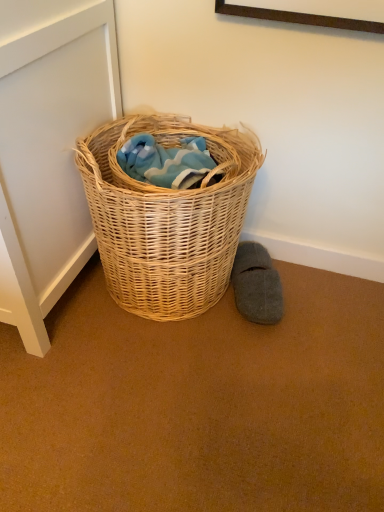
Image resolution: width=384 pixels, height=512 pixels. What do you see at coordinates (167, 218) in the screenshot?
I see `woven natural basket at center` at bounding box center [167, 218].

The height and width of the screenshot is (512, 384). What are the coordinates of `woven natural basket at center` in the screenshot? It's located at tap(167, 218).

Image resolution: width=384 pixels, height=512 pixels. What do you see at coordinates (256, 285) in the screenshot?
I see `gray felt slipper at lower right` at bounding box center [256, 285].

Locate an element on the screen. gray felt slipper at lower right is located at coordinates (256, 285).

Locate an element on the screen. woven natural basket at center is located at coordinates (167, 218).

Can you confirm if gray felt slipper at lower right is positioned to the right of woven natural basket at center?

Yes.

Is gray felt slipper at lower right positioned behind woven natural basket at center?

Yes, it is.

Is point (244, 259) in front of point (137, 286)?

No.

From the image's perspective, between gray felt slipper at lower right and woven natural basket at center, who is located below?

gray felt slipper at lower right is shown below in the image.

From a real-world perspective, which object rests below the other?

gray felt slipper at lower right is physically lower.

Considering the sizes of objects gray felt slipper at lower right and woven natural basket at center in the image provided, who is thinner, gray felt slipper at lower right or woven natural basket at center?

Thinner between the two is gray felt slipper at lower right.

Based on the photo, considering the sizes of objects gray felt slipper at lower right and woven natural basket at center in the image provided, who is taller, gray felt slipper at lower right or woven natural basket at center?

woven natural basket at center is taller.

Does gray felt slipper at lower right have a larger size compared to woven natural basket at center?

No.

Do you think gray felt slipper at lower right is within woven natural basket at center, or outside of it?

gray felt slipper at lower right exists outside the volume of woven natural basket at center.

Is gray felt slipper at lower right not near woven natural basket at center?

Actually, gray felt slipper at lower right and woven natural basket at center are a little close together.

Is gray felt slipper at lower right facing towards woven natural basket at center?

No.

Locate an element on the screen. Image resolution: width=384 pixels, height=512 pixels. picnic basket above the gray felt slipper at lower right (from a real-world perspective) is located at coordinates (167, 218).

Considering the relative positions of woven natural basket at center and gray felt slipper at lower right in the image provided, is woven natural basket at center to the left of gray felt slipper at lower right from the viewer's perspective?

Yes.

Relative to gray felt slipper at lower right, is woven natural basket at center in front or behind?

woven natural basket at center is in front of gray felt slipper at lower right.

Considering the points (187, 268) and (270, 292), which point is behind, point (187, 268) or point (270, 292)?

The point (270, 292) is more distant.

From the image's perspective, would you say woven natural basket at center is shown under gray felt slipper at lower right?

Incorrect, from the image's perspective, woven natural basket at center is higher than gray felt slipper at lower right.

From a real-world perspective, which object rests below the other?

gray felt slipper at lower right is physically lower.

From the picture: Can you confirm if woven natural basket at center is wider than gray felt slipper at lower right?

Yes.

Who is shorter, woven natural basket at center or gray felt slipper at lower right?

With less height is gray felt slipper at lower right.

Based on their sizes in the image, would you say woven natural basket at center is bigger or smaller than gray felt slipper at lower right?

In the image, woven natural basket at center appears to be larger than gray felt slipper at lower right.

Which is correct: woven natural basket at center is inside gray felt slipper at lower right, or outside of it?

woven natural basket at center is not enclosed by gray felt slipper at lower right.

Looking at this image, is woven natural basket at center not close to gray felt slipper at lower right?

woven natural basket at center is actually quite close to gray felt slipper at lower right.

Is woven natural basket at center facing away from gray felt slipper at lower right?

That's not correct — woven natural basket at center is not looking away from gray felt slipper at lower right.

Locate an element on the screen. Image resolution: width=384 pixels, height=512 pixels. footwear that appears below the woven natural basket at center (from the image's perspective) is located at coordinates (256, 285).

You are a GUI agent. You are given a task and a screenshot of the screen. Output one action in this format:
    pyautogui.click(x=<x>, y=<y>)
    Task: Click on the footwear behind the woven natural basket at center
    Image resolution: width=384 pixels, height=512 pixels.
    Given the screenshot: What is the action you would take?
    pyautogui.click(x=256, y=285)

There is a gray felt slipper at lower right. Identify the location of picnic basket above it (from a real-world perspective). (167, 218).